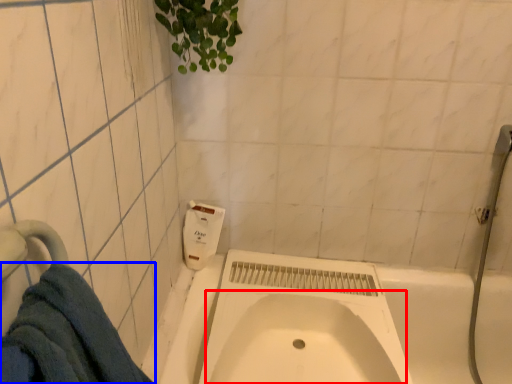
Question: Among these objects, which one is nearest to the camera, sink (highlighted by a red box) or towel (highlighted by a blue box)?

Choices:
 (A) sink
 (B) towel

Answer: (B)